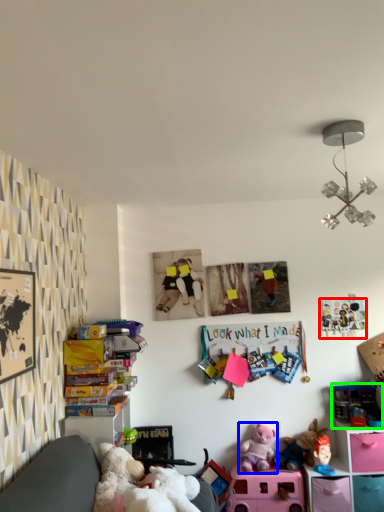
Question: Which object is the farthest from toy (highlighted by a red box)? Choose among these: toy (highlighted by a blue box) or toy (highlighted by a green box).

Choices:
 (A) toy
 (B) toy

Answer: (A)